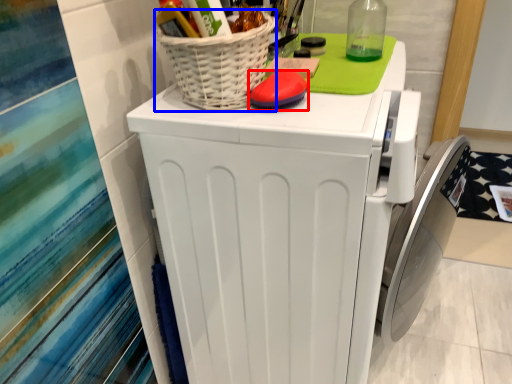
Question: Which object appears farthest to the camera in this image, soap (highlighted by a red box) or basket (highlighted by a blue box)?

Choices:
 (A) soap
 (B) basket

Answer: (A)